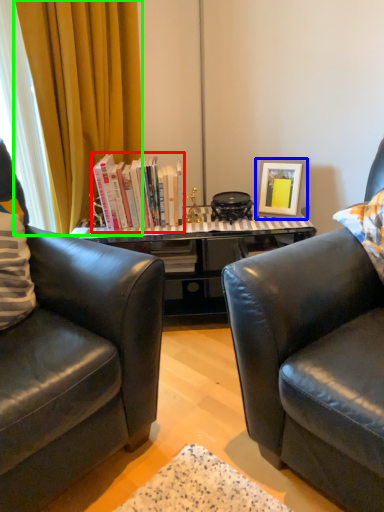
Question: Which is nearer to the book (highlighted by a red box)? picture frame (highlighted by a blue box) or curtain (highlighted by a green box).

Choices:
 (A) picture frame
 (B) curtain

Answer: (B)